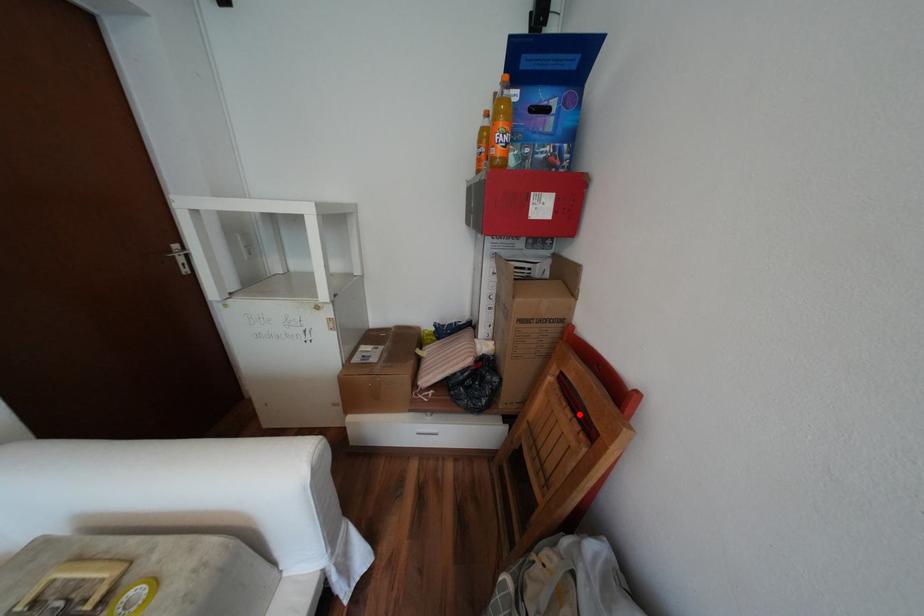
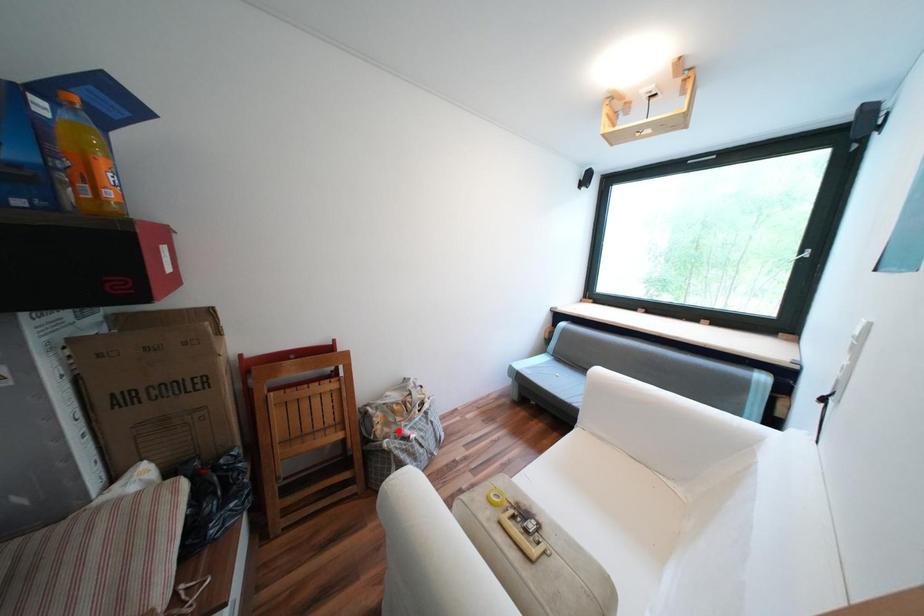
I am providing you with two images of the same scene from different viewpoints. A red point is marked on the first image and another point is marked on the second image. Is the red point in image1 aligned with the point shown in image2?

No